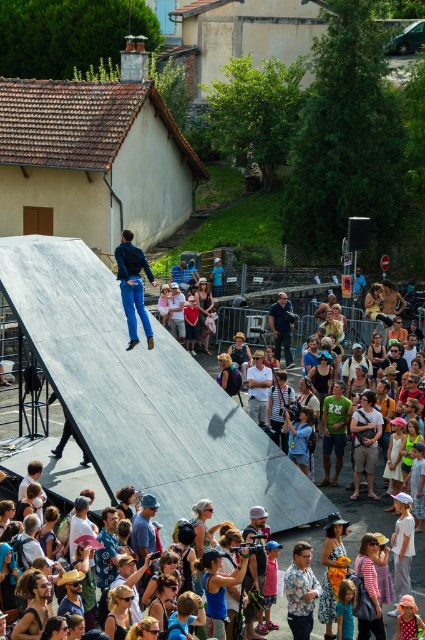
You are a photographer trying to capture the skateboarder wearing denim pants at center and dark blue shirt at center. Which part of their outfit should you focus on to ensure the widest possible shot without cropping?

The denim pants at center are wider than the dark blue shirt at center, so focusing on the denim pants at center will allow for a wider shot.

You are a photographer at the skateboarding event. You need to capture a photo of both the denim pants at center and the floral shirt at lower center in the same frame. Which object should you focus on first to ensure both are in the shot?

You should focus on the denim pants at center first since it is positioned to the left of the floral shirt at lower center, ensuring both are included in the frame.

You are a photographer at the skateboarding event. You want to capture a clear photo of the skateboarder performing a trick. However, there are two people in the way at the center of your viewfinder. The khaki cotton shorts at center and the green jersey at center are blocking your shot. Which clothing item should you move to get a better view of the skateboarder?

The khaki cotton shorts at center is in front of the green jersey at center, so you should move the person wearing the khaki cotton shorts at center to get a better view of the skateboarder.